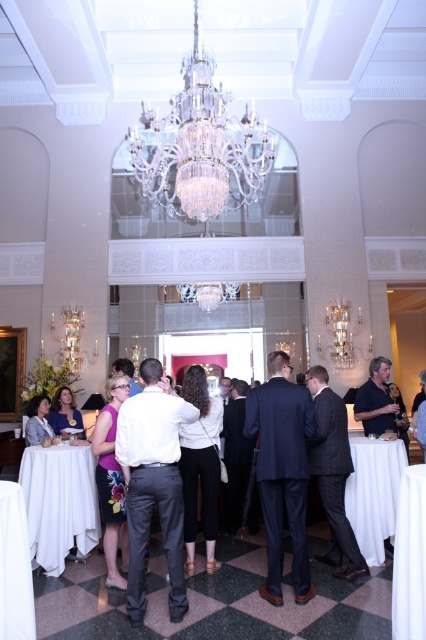
You are a guest at this event and want to sit down at the white cloth table at lower left. However, there is a matte purple dress at lower left in the way. Can you walk directly to the table without moving the dress?

The white cloth table at lower left is below the matte purple dress at lower left, meaning the dress is positioned above the table. Since the dress is hanging or placed above, you can walk directly to the table without needing to move it.

You are standing in the reception area and want to take a photo of the point at coordinates point [293,563]. If your camera has a maximum focus range of 4 meters, will it be able to capture the point clearly?

The distance of point [293,563] from camera is 3.86 meters, which is within the camera maximum focus range of 4 meters. Therefore, the camera can capture the point clearly.